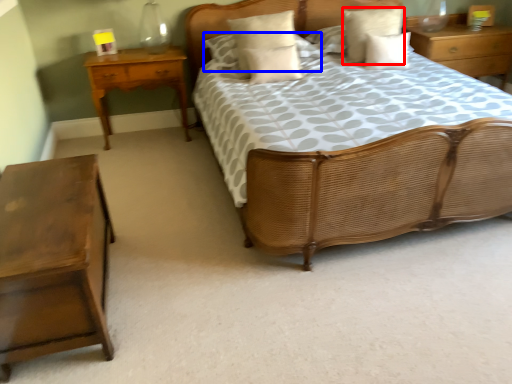
Question: Which object appears closest to the camera in this image, pillow (highlighted by a red box) or pillow (highlighted by a blue box)?

Choices:
 (A) pillow
 (B) pillow

Answer: (A)